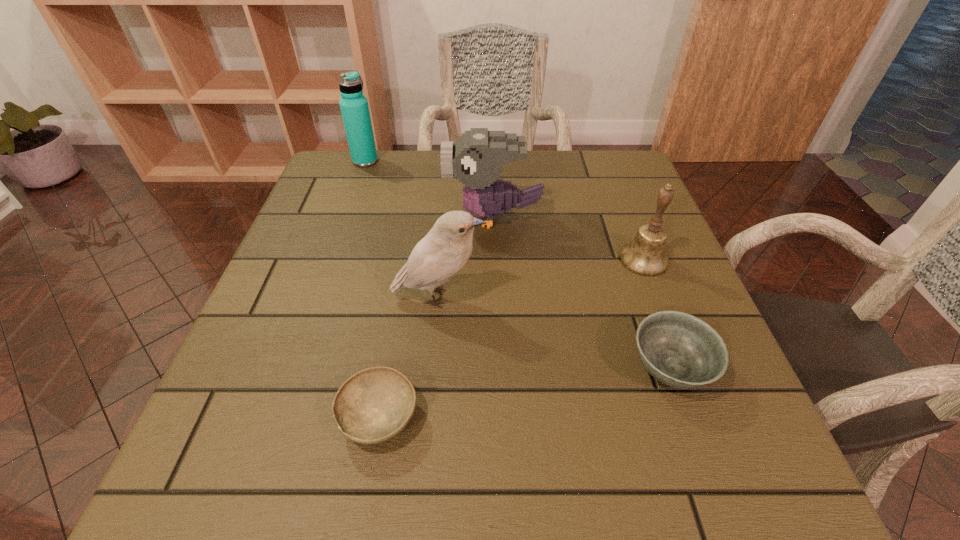
The height and width of the screenshot is (540, 960). What are the coordinates of `the farthest object` in the screenshot? It's located at (354, 107).

You are a GUI agent. You are given a task and a screenshot of the screen. Output one action in this format:
    pyautogui.click(x=<x>, y=<y>)
    Task: Click on the water bottle
    
    Given the screenshot: What is the action you would take?
    pyautogui.click(x=354, y=107)

Locate an element on the screen. the farther bird is located at coordinates (477, 158).

Locate an element on the screen. This screenshot has height=540, width=960. the nearer bird is located at coordinates (441, 254).

At what (x,y) coordinates should I click in order to perform the action: click on the third farthest object. Please return your answer as a coordinate pair (x, y). The height and width of the screenshot is (540, 960). Looking at the image, I should click on (645, 255).

I want to click on the second shortest object, so click(678, 349).

Where is `the taller bowl`? The image size is (960, 540). the taller bowl is located at coordinates (678, 349).

Find the location of `the left bowl`. the left bowl is located at coordinates (375, 404).

Locate an element on the screen. The width and height of the screenshot is (960, 540). the shorter bowl is located at coordinates (375, 404).

You are a GUI agent. You are given a task and a screenshot of the screen. Output one action in this format:
    pyautogui.click(x=<x>, y=<y>)
    Task: Click on the vacant space located 0.150m on the front of the water bottle
    
    Given the screenshot: What is the action you would take?
    pyautogui.click(x=351, y=199)